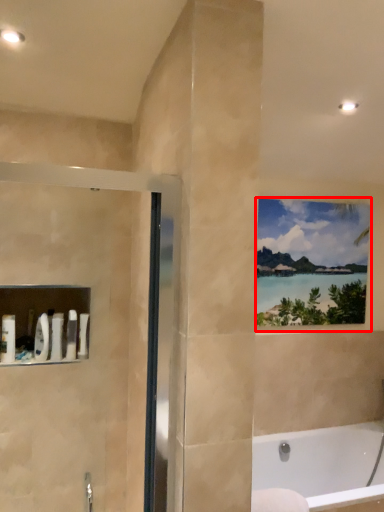
Question: Considering the relative positions of window (annotated by the red box) and bathtub in the image provided, where is window (annotated by the red box) located with respect to the staircase?

Choices:
 (A) right
 (B) left

Answer: (B)